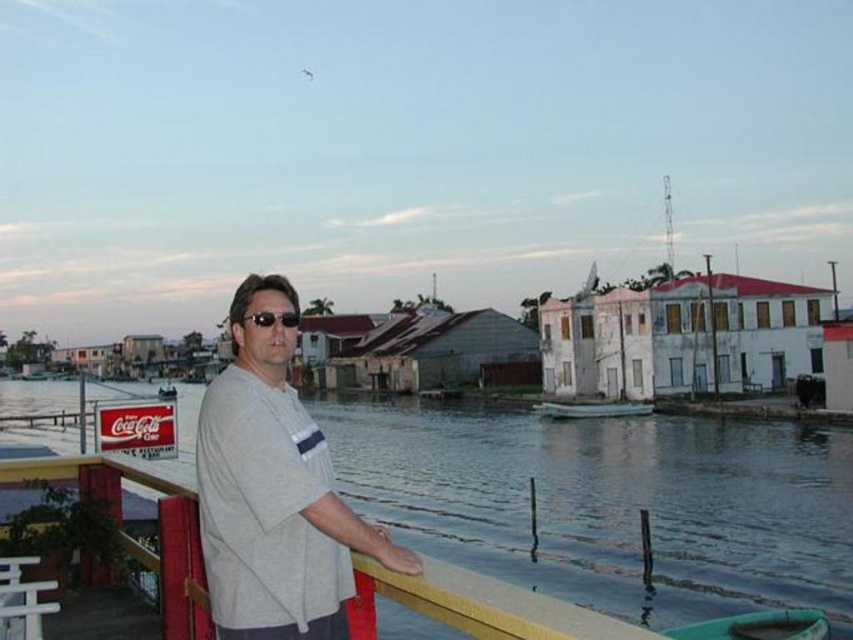
Question: Among these objects, which one is farthest from the camera?

Choices:
 (A) matte black sunglasses at center
 (B) smooth water at center
 (C) white matte boat at center

Answer: (C)

Question: Is the position of gray cotton shirt at center less distant than that of white matte boat at center?

Choices:
 (A) no
 (B) yes

Answer: (B)

Question: Is gray cotton shirt at center thinner than white matte boat at center?

Choices:
 (A) no
 (B) yes

Answer: (B)

Question: Which object is farther from the camera taking this photo?

Choices:
 (A) white matte boat at center
 (B) matte black sunglasses at center

Answer: (A)

Question: Is smooth water at center bigger than gray cotton shirt at center?

Choices:
 (A) yes
 (B) no

Answer: (A)

Question: Which of the following is the closest to the observer?

Choices:
 (A) (560, 417)
 (B) (531, 460)
 (C) (282, 324)
 (D) (225, 404)

Answer: (D)